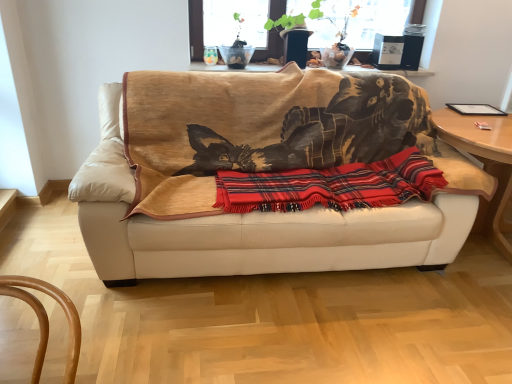
Question: Is beige leather couch at center completely or partially inside wooden table at upper center, the second table when ordered from right to left?

Choices:
 (A) yes
 (B) no

Answer: (B)

Question: Considering the relative sizes of wooden table at upper center, the second table when ordered from right to left, and beige leather couch at center in the image provided, is wooden table at upper center, the second table when ordered from right to left, thinner than beige leather couch at center?

Choices:
 (A) no
 (B) yes

Answer: (B)

Question: Does wooden table at upper center, placed as the second table when sorted from bottom to top, have a greater height compared to beige leather couch at center?

Choices:
 (A) no
 (B) yes

Answer: (A)

Question: Considering the relative sizes of wooden table at upper center, which is the first table from top to bottom, and beige leather couch at center in the image provided, is wooden table at upper center, which is the first table from top to bottom, shorter than beige leather couch at center?

Choices:
 (A) no
 (B) yes

Answer: (B)

Question: Is wooden table at upper center, which is the first table from top to bottom, positioned before beige leather couch at center?

Choices:
 (A) yes
 (B) no

Answer: (B)

Question: Is point (458, 152) positioned closer to the camera than point (485, 137)?

Choices:
 (A) closer
 (B) farther

Answer: (B)

Question: In terms of size, does beige leather couch at center appear bigger or smaller than wooden round table at right, the 1th table when ordered from right to left?

Choices:
 (A) big
 (B) small

Answer: (A)

Question: Looking at their shapes, would you say beige leather couch at center is wider or thinner than wooden round table at right, the 1th table when ordered from right to left?

Choices:
 (A) wide
 (B) thin

Answer: (B)

Question: In the image, is beige leather couch at center on the left side or the right side of wooden round table at right, which appears as the second table when viewed from the top?

Choices:
 (A) left
 (B) right

Answer: (A)

Question: From a real-world perspective, is beige leather couch at center above or below wooden table at upper center, placed as the second table when sorted from bottom to top?

Choices:
 (A) below
 (B) above

Answer: (A)

Question: Is beige leather couch at center taller or shorter than wooden table at upper center, the second table when ordered from right to left?

Choices:
 (A) tall
 (B) short

Answer: (A)

Question: Is point (306, 100) closer or farther from the camera than point (194, 64)?

Choices:
 (A) closer
 (B) farther

Answer: (A)

Question: In terms of width, does beige leather couch at center look wider or thinner when compared to wooden table at upper center, which is counted as the first table, starting from the left?

Choices:
 (A) thin
 (B) wide

Answer: (B)

Question: From the image's perspective, is red plaid blanket at center located above or below beige leather couch at center?

Choices:
 (A) below
 (B) above

Answer: (A)

Question: Visually, is red plaid blanket at center positioned to the left or to the right of beige leather couch at center?

Choices:
 (A) left
 (B) right

Answer: (B)